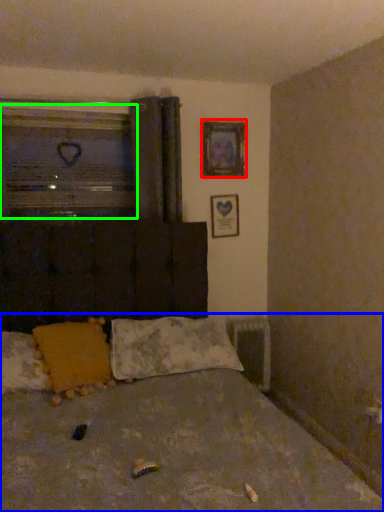
Question: Which is farther away from picture frame (highlighted by a red box)? bed (highlighted by a blue box) or window (highlighted by a green box)?

Choices:
 (A) bed
 (B) window

Answer: (A)